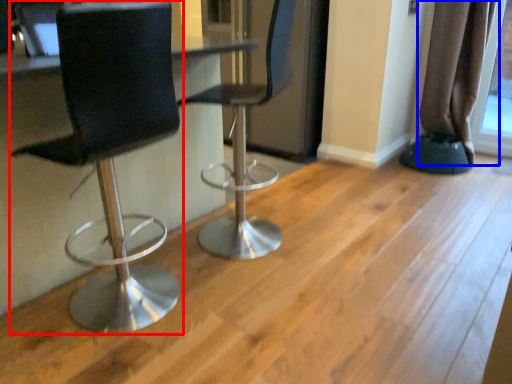
Question: Which of the following is the closest to the observer, chair (highlighted by a red box) or curtain (highlighted by a blue box)?

Choices:
 (A) chair
 (B) curtain

Answer: (A)